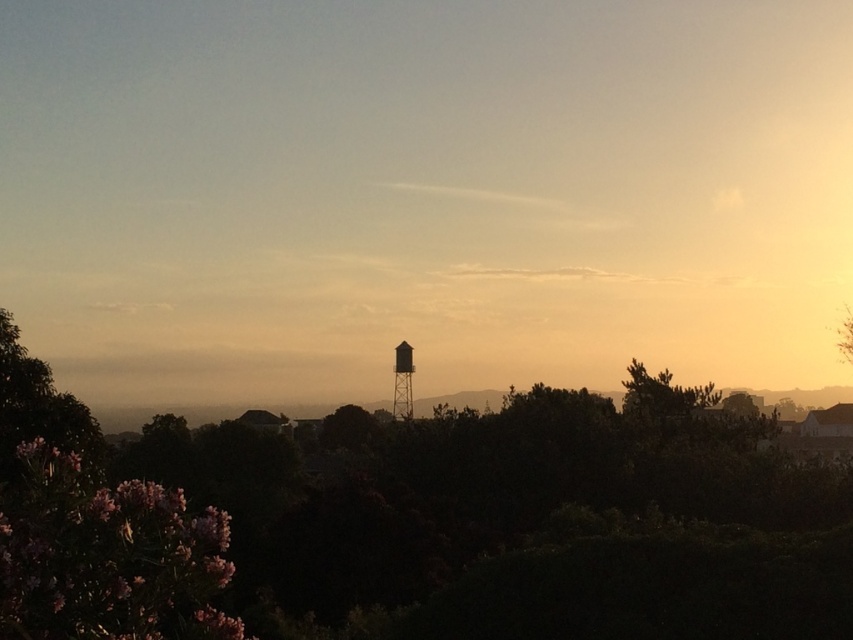
Measure the distance between green matte tree at center and metallic water tower at center.

A distance of 102.31 feet exists between green matte tree at center and metallic water tower at center.

How much distance is there between green matte tree at center and metallic water tower at center?

green matte tree at center and metallic water tower at center are 102.31 feet apart.

Between point (97, 636) and point (399, 403), which one is positioned behind?

The point (399, 403) is behind.

Image resolution: width=853 pixels, height=640 pixels. Find the location of `green matte tree at center`. green matte tree at center is located at coordinates (419, 522).

Who is higher up, pink matte flowers at lower left or silvery metallic water tower at center?

pink matte flowers at lower left is above.

Can you confirm if pink matte flowers at lower left is positioned above silvery metallic water tower at center?

Yes, pink matte flowers at lower left is above silvery metallic water tower at center.

Who is more distant from viewer, (102, 611) or (399, 364)?

The point (399, 364) is more distant.

Find the location of a particular element. This screenshot has width=853, height=640. pink matte flowers at lower left is located at coordinates (108, 560).

Does silvery metallic water tower at center have a smaller size compared to metallic water tower at center?

No, silvery metallic water tower at center is not smaller than metallic water tower at center.

Can you confirm if silvery metallic water tower at center is positioned below metallic water tower at center?

No, silvery metallic water tower at center is not below metallic water tower at center.

Where is `silvery metallic water tower at center`? silvery metallic water tower at center is located at coordinates (402, 381).